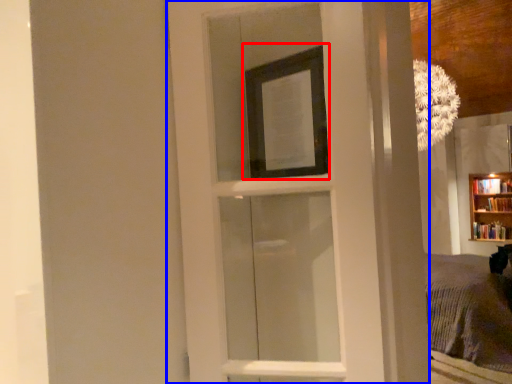
Question: Which point is further to the camera, picture frame (highlighted by a red box) or door (highlighted by a blue box)?

Choices:
 (A) picture frame
 (B) door

Answer: (A)